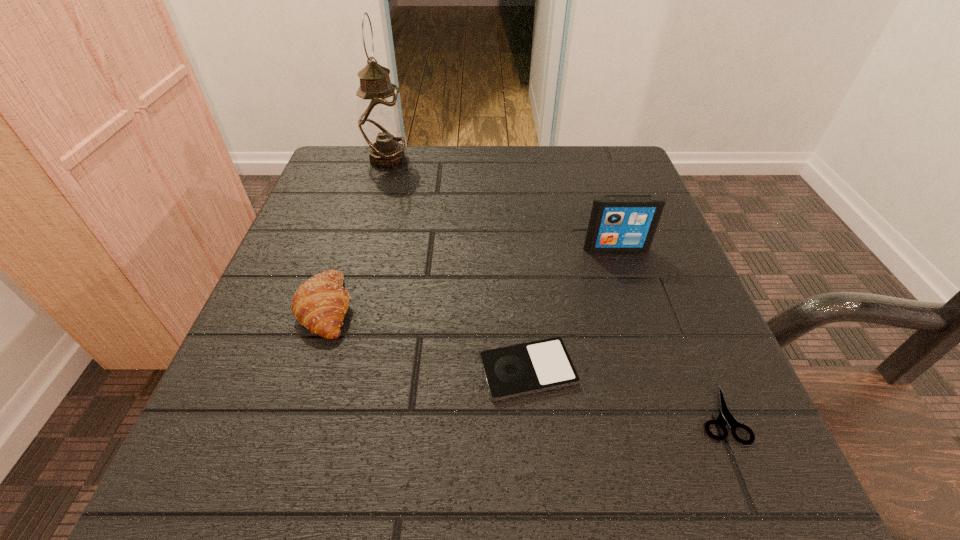
Locate an element on the screen. the farthest object is located at coordinates (381, 124).

Where is `the tallest object`? The width and height of the screenshot is (960, 540). the tallest object is located at coordinates (381, 124).

Identify the location of the second tallest object. Image resolution: width=960 pixels, height=540 pixels. (618, 223).

Where is `the farther iPod`? The image size is (960, 540). the farther iPod is located at coordinates (618, 223).

The image size is (960, 540). Identify the location of crescent roll. (320, 304).

You are a GUI agent. You are given a task and a screenshot of the screen. Output one action in this format:
    pyautogui.click(x=<x>, y=<y>)
    Task: Click on the left iPod
    The image size is (960, 540).
    Given the screenshot: What is the action you would take?
    pyautogui.click(x=522, y=369)

This screenshot has width=960, height=540. I want to click on the shorter iPod, so click(x=522, y=369).

In order to click on the shortest object in this screenshot , I will do `click(725, 416)`.

Identify the location of vacant area situated 0.110m on the front of the tallest object. pyautogui.click(x=375, y=200).

What are the coordinates of `vacant space located on the front screen of the farther iPod` in the screenshot? It's located at (648, 346).